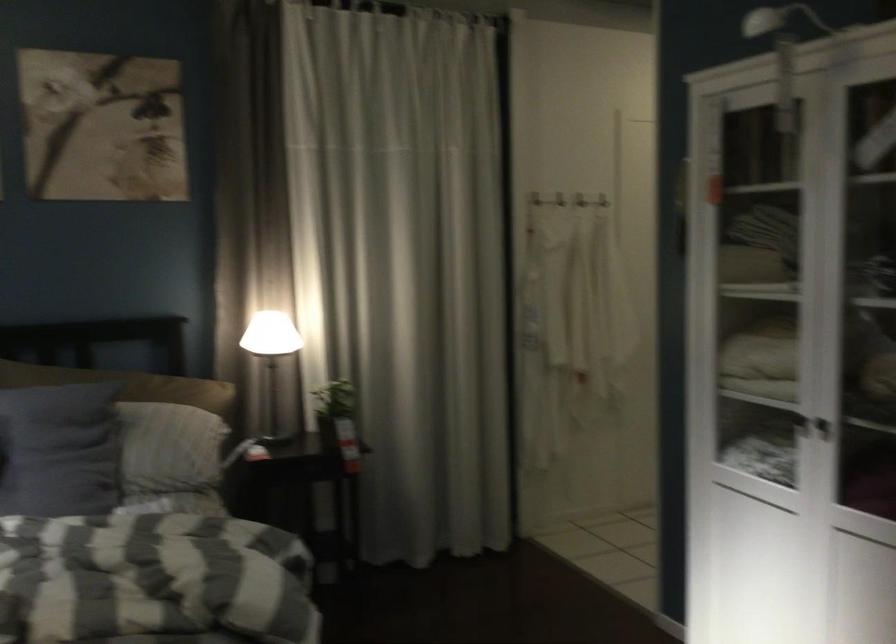
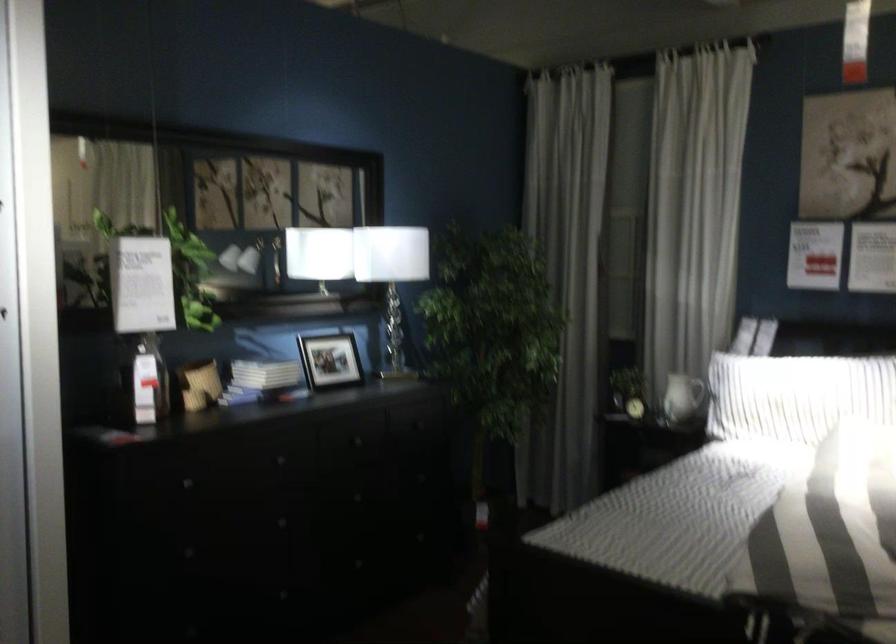
Question: The first image is from the beginning of the video and the second image is from the end. How did the camera likely rotate when shooting the video?

Choices:
 (A) Left
 (B) Right
 (C) Up
 (D) Down

Answer: (A)